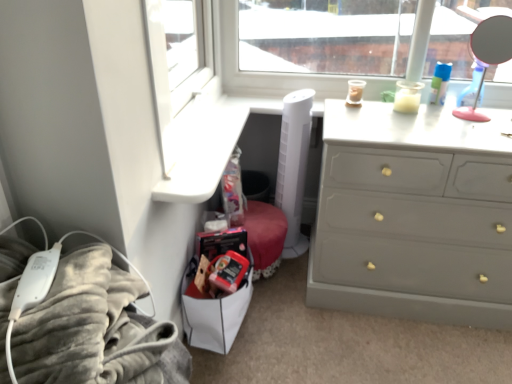
Question: Looking at their shapes, would you say velvety gray blanket at lower left is wider or thinner than matte gray dresser at right?

Choices:
 (A) thin
 (B) wide

Answer: (A)

Question: Is point (27, 342) positioned closer to the camera than point (494, 309)?

Choices:
 (A) farther
 (B) closer

Answer: (B)

Question: Which of these objects is positioned farthest from the polished silver mirror at upper right?

Choices:
 (A) matte gray dresser at right
 (B) velvety gray blanket at lower left

Answer: (B)

Question: Which of these objects is positioned farthest from the polished silver mirror at upper right?

Choices:
 (A) velvety gray blanket at lower left
 (B) matte gray dresser at right

Answer: (A)